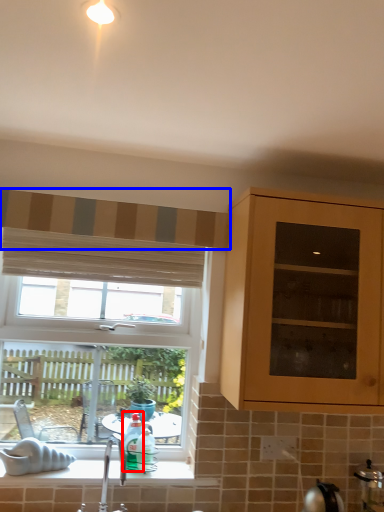
Question: Which of the following is the farthest to the observer, bottle (highlighted by a red box) or curtain (highlighted by a blue box)?

Choices:
 (A) bottle
 (B) curtain

Answer: (A)